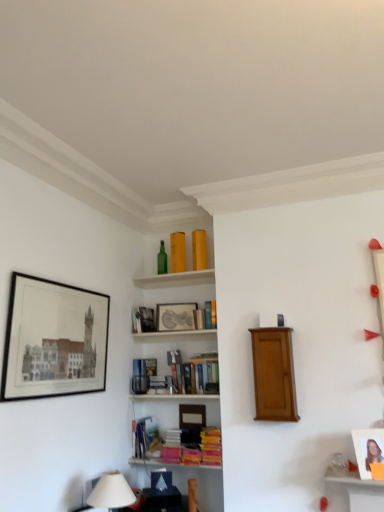
Where is `empty space that is ontop of matte black picture frame at upper left, placed as the third picture frame when sorted from right to left (from a real-world perspective)`? The image size is (384, 512). empty space that is ontop of matte black picture frame at upper left, placed as the third picture frame when sorted from right to left (from a real-world perspective) is located at coordinates (64, 284).